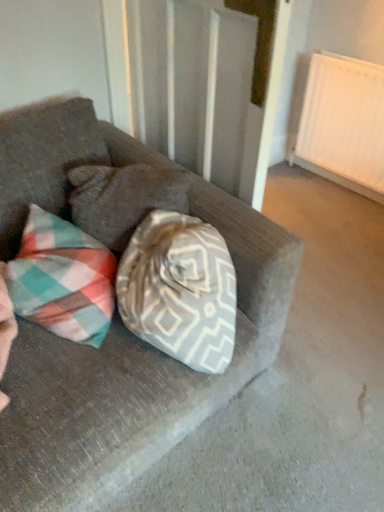
What do you see at coordinates (123, 199) in the screenshot?
I see `plaid fabric pillow at center` at bounding box center [123, 199].

Identify the location of plaid fabric pillow at center. pyautogui.click(x=123, y=199).

Measure the distance between white textured curtain at upper center and camera.

A distance of 3.70 feet exists between white textured curtain at upper center and camera.

What is the approximate height of suede couch at center?

84.98 centimeters.

Image resolution: width=384 pixels, height=512 pixels. Identify the location of suede couch at center. (135, 378).

What are the coordinates of `plaid fabric pillow at center` in the screenshot? It's located at (123, 199).

Find the location of `curtain that appears in front of the plaid fabric pillow at center`. curtain that appears in front of the plaid fabric pillow at center is located at coordinates (191, 84).

Is white textured curtain at upper center at the left side of plaid fabric pillow at center?

→ No, white textured curtain at upper center is not to the left of plaid fabric pillow at center.

Which object is further away from the camera taking this photo, white textured curtain at upper center or plaid fabric pillow at center?

Positioned behind is plaid fabric pillow at center.

Is white textured curtain at upper center in contact with plaid fabric pillow at center?

No, white textured curtain at upper center is not touching plaid fabric pillow at center.

Based on the photo, is plaid fabric pillow at center bigger or smaller than white textured curtain at upper center?

Considering their sizes, plaid fabric pillow at center takes up less space than white textured curtain at upper center.

What's the angular difference between plaid fabric pillow at center and white textured curtain at upper center's facing directions?

There is a 137-degree angle between the facing directions of plaid fabric pillow at center and white textured curtain at upper center.

Considering the positions of points (123, 218) and (150, 135), is point (123, 218) closer to camera compared to point (150, 135)?

That is True.

Is plaid fabric pillow at center with white textured curtain at upper center?

There is a gap between plaid fabric pillow at center and white textured curtain at upper center.

Based on their positions, is white textured curtain at upper center located to the left or right of white matte radiator at upper right?

white textured curtain at upper center is positioned on white matte radiator at upper right's left side.

Image resolution: width=384 pixels, height=512 pixels. I want to click on radiator above the white textured curtain at upper center (from the image's perspective), so tap(343, 123).

From a real-world perspective, which object stands above the other?

white textured curtain at upper center, from a real-world perspective.

Is white textured curtain at upper center spatially inside white matte radiator at upper right, or outside of it?

white textured curtain at upper center is spatially situated outside white matte radiator at upper right.

Is suede couch at center far from plaid fabric pillow at center?

No, suede couch at center is not far from plaid fabric pillow at center.

Is plaid fabric pillow at center located within suede couch at center?

Yes, suede couch at center contains plaid fabric pillow at center.

Can you confirm if suede couch at center is smaller than plaid fabric pillow at center?

No.

From a real-world perspective, is suede couch at center on top of white textured curtain at upper center?

Incorrect, from a real-world perspective, suede couch at center is lower than white textured curtain at upper center.

Is suede couch at center turned away from white textured curtain at upper center?

No, suede couch at center is not facing away from white textured curtain at upper center.

Between suede couch at center and white textured curtain at upper center, which one has smaller width?

Thinner between the two is white textured curtain at upper center.

Is the depth of suede couch at center greater than that of white textured curtain at upper center?

No.

From a real-world perspective, between white matte radiator at upper right and white textured curtain at upper center, who is vertically higher?

In real-world perspective, white textured curtain at upper center is above.

This screenshot has height=512, width=384. In order to click on curtain that is below the white matte radiator at upper right (from the image's perspective) in this screenshot , I will do `click(191, 84)`.

Is white matte radiator at upper right aimed at white textured curtain at upper center?

Yes, white matte radiator at upper right is turned towards white textured curtain at upper center.

Could white textured curtain at upper center be considered to be inside white matte radiator at upper right?

No.

Which of these two, white matte radiator at upper right or suede couch at center, stands taller?

With more height is suede couch at center.

Consider the image. What's the angular difference between white matte radiator at upper right and suede couch at center's facing directions?

There is a 88.7-degree angle between the facing directions of white matte radiator at upper right and suede couch at center.

From a real-world perspective, is white matte radiator at upper right located beneath suede couch at center?

Correct, in the physical world, white matte radiator at upper right is lower than suede couch at center.

Which of these two, white matte radiator at upper right or suede couch at center, is thinner?

white matte radiator at upper right is thinner.

This screenshot has height=512, width=384. Find the location of `curtain above the plaid fabric pillow at center (from the image's perspective)`. curtain above the plaid fabric pillow at center (from the image's perspective) is located at coordinates (191, 84).

The width and height of the screenshot is (384, 512). I want to click on curtain positioned vertically above the plaid fabric pillow at center (from a real-world perspective), so click(191, 84).

From the image, which object appears to be farther from white matte radiator at upper right, plaid fabric pillow at center or suede couch at center?

plaid fabric pillow at center lies further to white matte radiator at upper right than the other object.

In the scene shown: Which object lies nearer to the anchor point white textured curtain at upper center, white matte radiator at upper right or plaid fabric pillow at center?

Based on the image, plaid fabric pillow at center appears to be nearer to white textured curtain at upper center.

Considering their positions, is white matte radiator at upper right positioned closer to plaid fabric pillow at center than suede couch at center?

suede couch at center is closer to plaid fabric pillow at center.

In the scene shown: Looking at the image, which one is located closer to plaid fabric pillow at center, white textured curtain at upper center or suede couch at center?

Among the two, suede couch at center is located nearer to plaid fabric pillow at center.

When comparing their distances from white textured curtain at upper center, does white matte radiator at upper right or suede couch at center seem further?

white matte radiator at upper right lies further to white textured curtain at upper center than the other object.

Looking at the image, which one is located closer to white matte radiator at upper right, suede couch at center or white textured curtain at upper center?

white textured curtain at upper center is closer to white matte radiator at upper right.

Considering their positions, is plaid fabric pillow at center positioned closer to white matte radiator at upper right than white textured curtain at upper center?

Among the two, white textured curtain at upper center is located nearer to white matte radiator at upper right.

When comparing their distances from plaid fabric pillow at center, does suede couch at center or white textured curtain at upper center seem further?

white textured curtain at upper center lies further to plaid fabric pillow at center than the other object.

At what (x,y) coordinates should I click in order to perform the action: click on curtain between plaid fabric pillow at center and white matte radiator at upper right from left to right. Please return your answer as a coordinate pair (x, y). Looking at the image, I should click on (191, 84).

The width and height of the screenshot is (384, 512). In order to click on curtain located between suede couch at center and white matte radiator at upper right in the depth direction in this screenshot , I will do `click(191, 84)`.

Image resolution: width=384 pixels, height=512 pixels. Identify the location of pillow that lies between white textured curtain at upper center and suede couch at center from top to bottom. (123, 199).

The height and width of the screenshot is (512, 384). What are the coordinates of `pillow between suede couch at center and white matte radiator at upper right from front to back` in the screenshot? It's located at (123, 199).